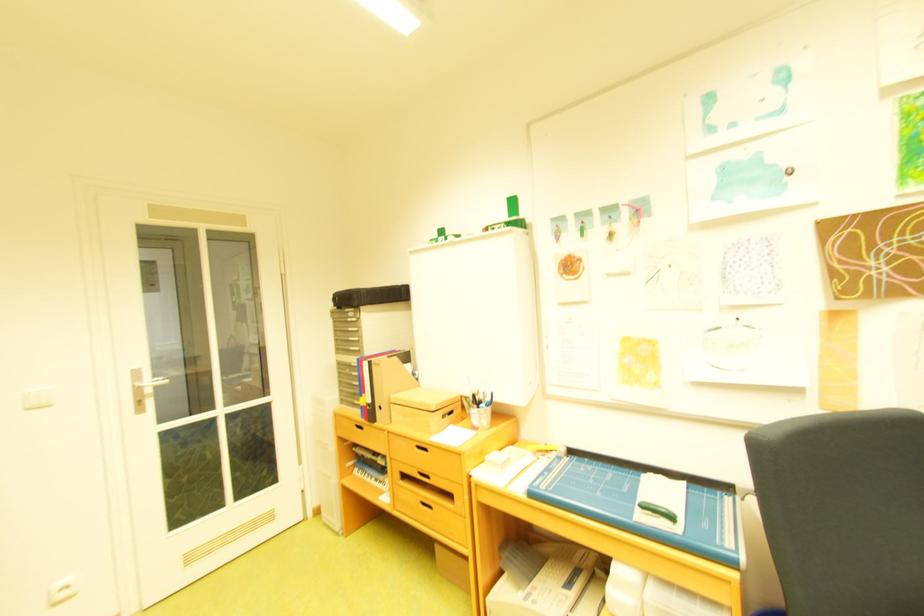
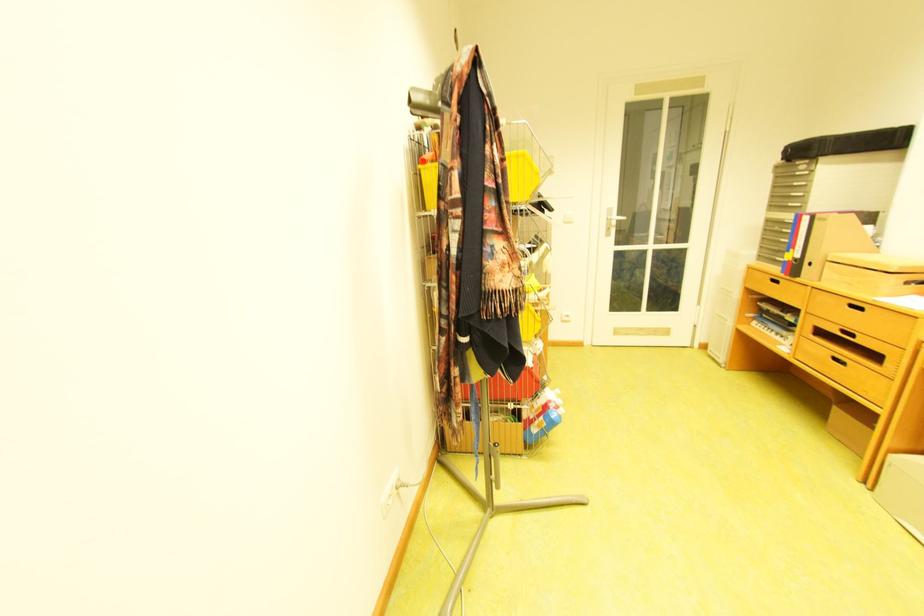
Find the pixel in the second image that matches point (148, 385) in the first image.

(621, 217)